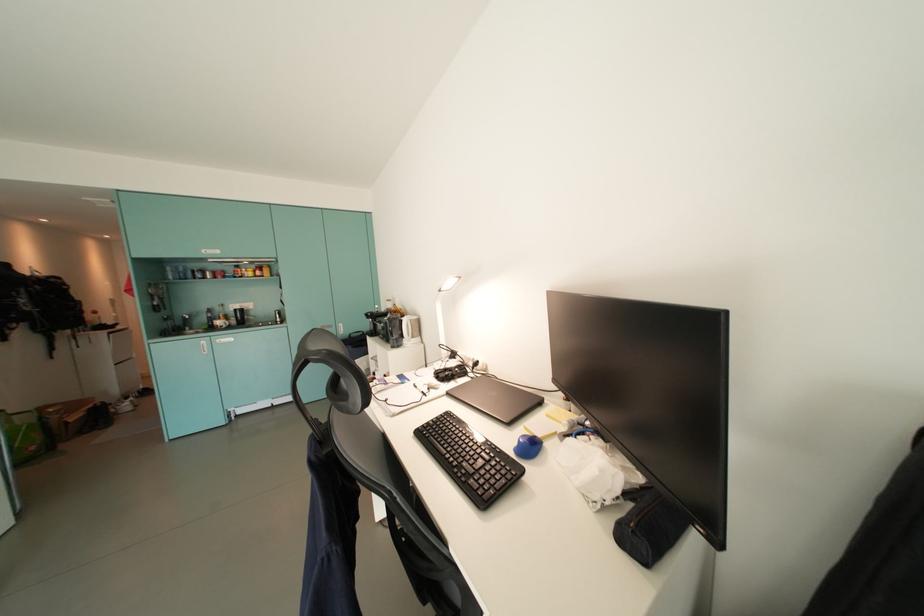
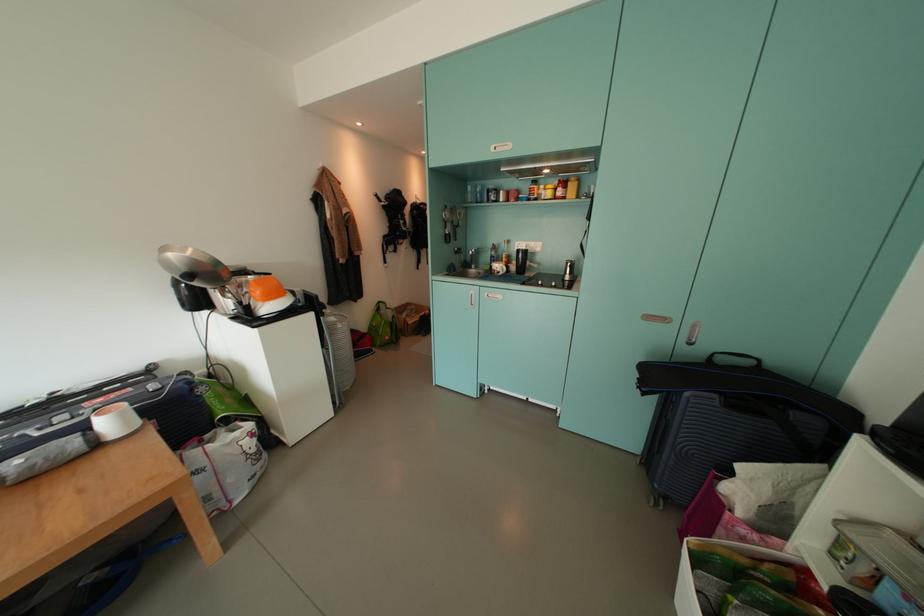
Locate, in the second image, the point that corresponds to (265,276) in the first image.

(566, 195)